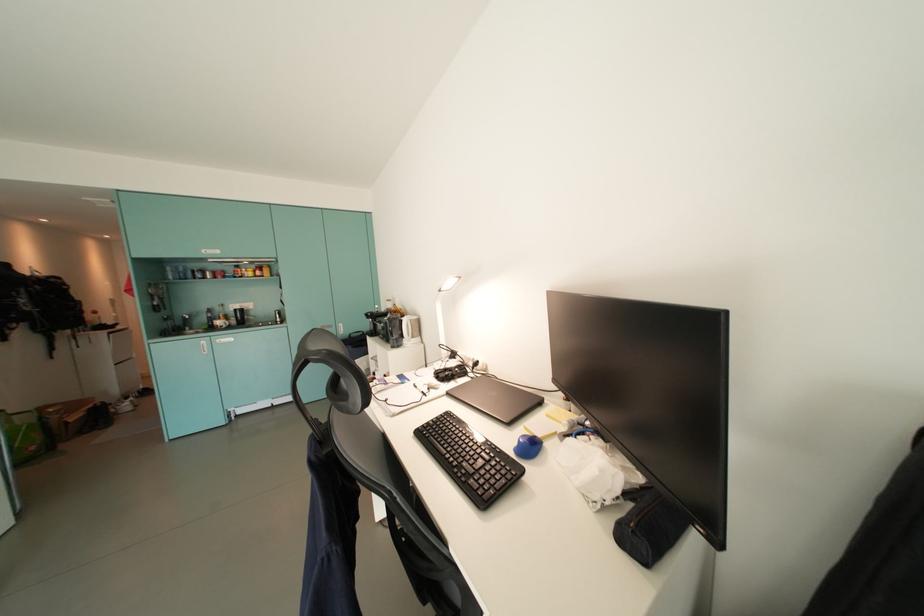
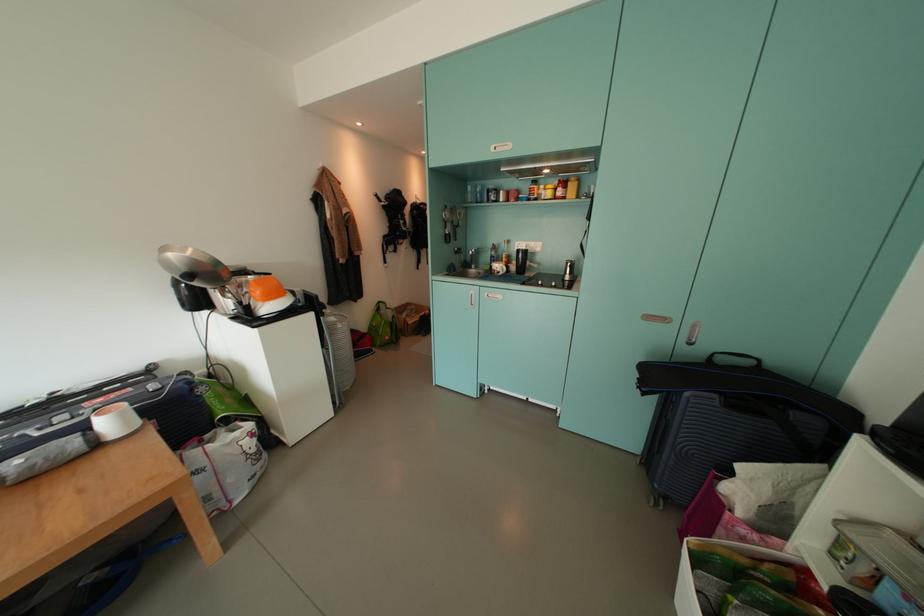
Locate, in the second image, the point that corresponds to (265,276) in the first image.

(566, 195)